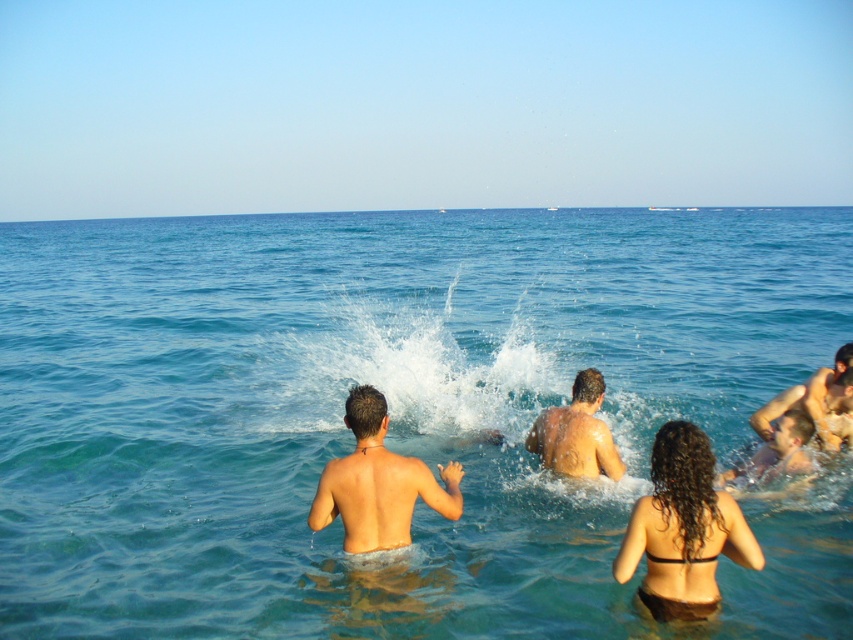
Question: Does clear water splash at center appear under matte skin man at center?

Choices:
 (A) no
 (B) yes

Answer: (A)

Question: Which object is closer to the camera taking this photo?

Choices:
 (A) clear water splash at center
 (B) shiny wet skin at center
 (C) brown textured skin at lower right

Answer: (B)

Question: Which object is positioned farthest from the smooth skin man at lower right?

Choices:
 (A) brown textured skin at lower right
 (B) clear water splash at center
 (C) shiny wet skin at center
 (D) clear blue water at center

Answer: (D)

Question: Does clear water splash at center have a greater width compared to matte skin man at center?

Choices:
 (A) no
 (B) yes

Answer: (B)

Question: Is clear water splash at center wider than shiny wet skin at center?

Choices:
 (A) yes
 (B) no

Answer: (A)

Question: Which point is farther to the camera?

Choices:
 (A) brown textured skin at lower right
 (B) matte skin man at center
 (C) shiny wet skin at center

Answer: (A)